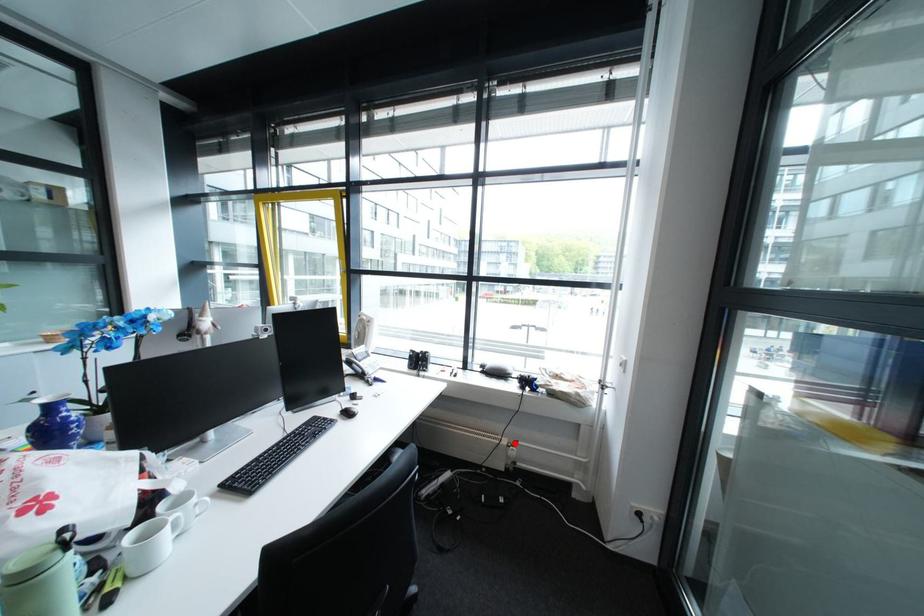
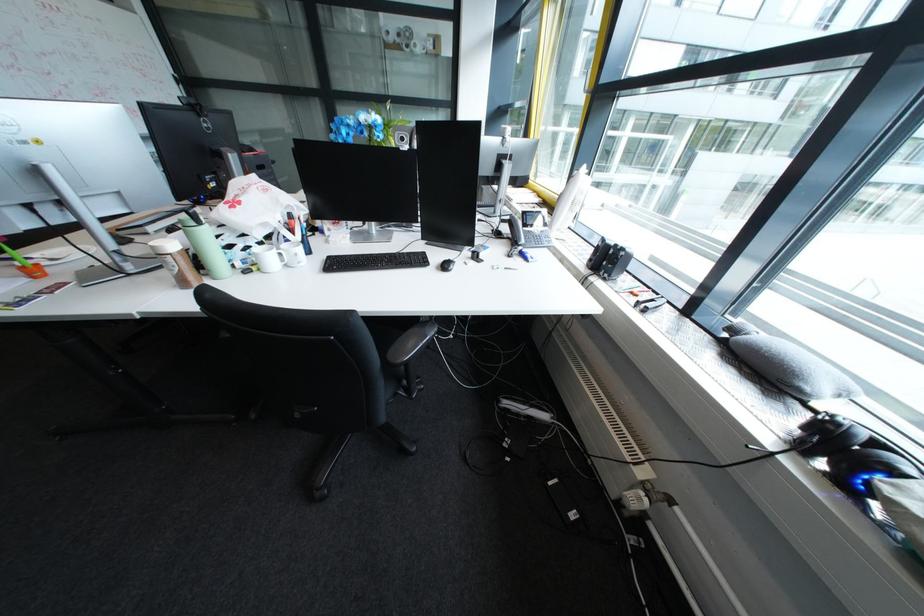
Question: I am providing you with two images of the same scene from different viewpoints. Given a red point in image1, look at the same physical point in image2. Is it:

Choices:
 (A) Closer to the viewpoint
 (B) Farther from the viewpoint

Answer: (A)